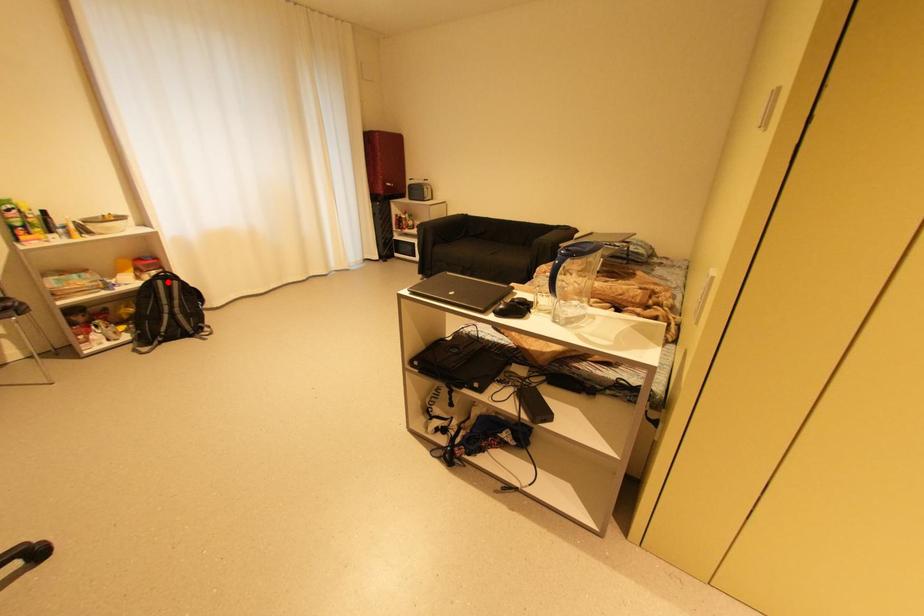
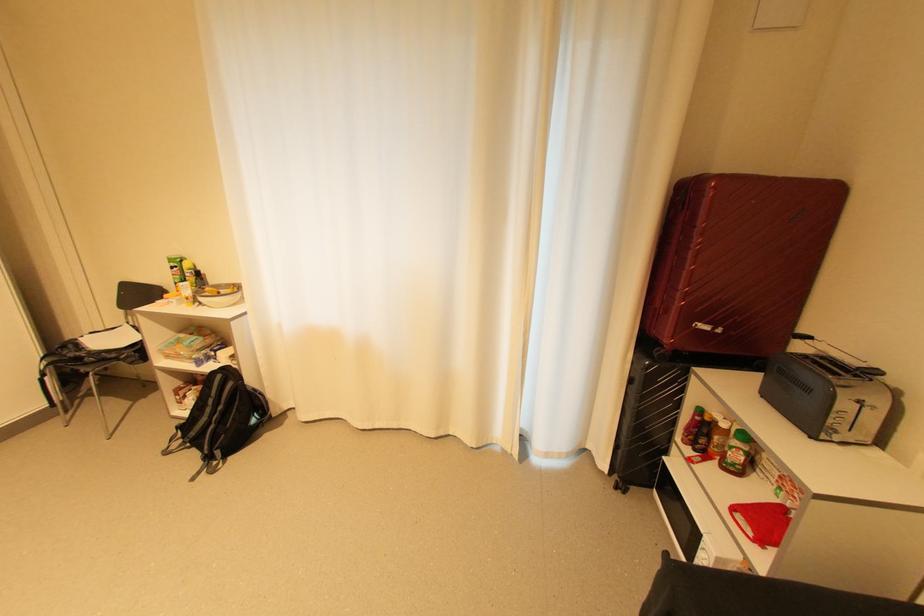
The point at the highlighted location is marked in the first image. Where is the corresponding point in the second image?

(226, 377)